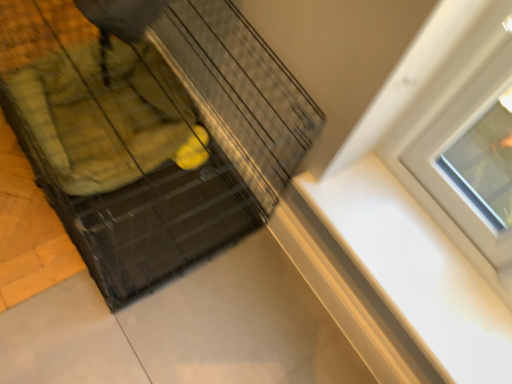
Question: From the image's perspective, is white glossy window sill at upper right positioned above or below black wire baby carriage at center?

Choices:
 (A) below
 (B) above

Answer: (A)

Question: From their relative heights in the image, would you say white glossy window sill at upper right is taller or shorter than black wire baby carriage at center?

Choices:
 (A) short
 (B) tall

Answer: (A)

Question: Is white glossy window sill at upper right situated inside black wire baby carriage at center or outside?

Choices:
 (A) inside
 (B) outside

Answer: (B)

Question: Does point (257, 94) appear closer or farther from the camera than point (465, 360)?

Choices:
 (A) closer
 (B) farther

Answer: (B)

Question: Is black wire baby carriage at center in front of or behind white glossy window sill at upper right in the image?

Choices:
 (A) front
 (B) behind

Answer: (A)

Question: From the image's perspective, is black wire baby carriage at center located above or below white glossy window sill at upper right?

Choices:
 (A) above
 (B) below

Answer: (A)

Question: Considering the positions of black wire baby carriage at center and white glossy window sill at upper right in the image, is black wire baby carriage at center taller or shorter than white glossy window sill at upper right?

Choices:
 (A) short
 (B) tall

Answer: (B)